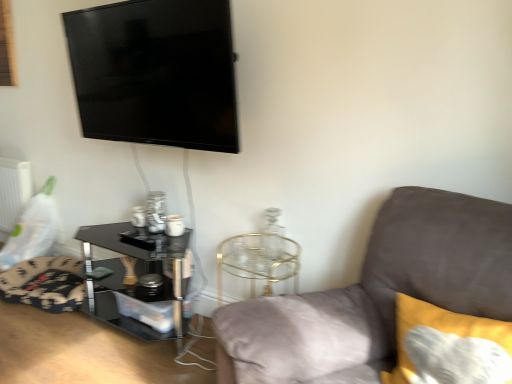
Describe the element at coordinates (155, 73) in the screenshot. Image resolution: width=512 pixels, height=384 pixels. I see `black glossy tv at upper left` at that location.

What do you see at coordinates (13, 191) in the screenshot? The image size is (512, 384). I see `white matte radiator at left` at bounding box center [13, 191].

In order to click on floral fabric swivel chair at lower left in this screenshot , I will do `click(45, 284)`.

The height and width of the screenshot is (384, 512). In order to click on black glass table at lower left in this screenshot , I will do `click(137, 275)`.

The image size is (512, 384). Describe the element at coordinates (376, 294) in the screenshot. I see `suede gray couch at right` at that location.

Image resolution: width=512 pixels, height=384 pixels. In order to click on black glossy tv at upper left in this screenshot , I will do `click(155, 73)`.

Is white matte radiator at left surrounding floral fabric swivel chair at lower left?

Actually, floral fabric swivel chair at lower left is outside white matte radiator at left.

From the image's perspective, is white matte radiator at left positioned above or below floral fabric swivel chair at lower left?

Clearly, from the image's perspective, white matte radiator at left is above floral fabric swivel chair at lower left.

From a real-world perspective, relative to floral fabric swivel chair at lower left, is white matte radiator at left vertically above or below?

In terms of real-world spatial position, white matte radiator at left is above floral fabric swivel chair at lower left.

Are white matte radiator at left and floral fabric swivel chair at lower left far apart?

No, white matte radiator at left is in close proximity to floral fabric swivel chair at lower left.

Based on the photo, does black glossy tv at upper left appear on the right side of suede gray couch at right?

No, black glossy tv at upper left is not to the right of suede gray couch at right.

From the picture: Can you confirm if black glossy tv at upper left is taller than suede gray couch at right?

Incorrect, the height of black glossy tv at upper left is not larger of that of suede gray couch at right.

From the image's perspective, between black glossy tv at upper left and suede gray couch at right, which one is located above?

black glossy tv at upper left is shown above in the image.

Can you confirm if black glossy tv at upper left is smaller than suede gray couch at right?

Correct, black glossy tv at upper left occupies less space than suede gray couch at right.

Which object is positioned more to the left, suede gray couch at right or black glass table at lower left?

Positioned to the left is black glass table at lower left.

Does point (317, 374) lie behind point (92, 299)?

That is False.

Is the depth of suede gray couch at right less than that of black glass table at lower left?

Yes, it is.

From the image's perspective, is suede gray couch at right above or below black glass table at lower left?

Clearly, from the image's perspective, suede gray couch at right is below black glass table at lower left.

Does suede gray couch at right have a larger size compared to soft yellow cushion at right?

Indeed, suede gray couch at right has a larger size compared to soft yellow cushion at right.

Which object is wider, suede gray couch at right or soft yellow cushion at right?

suede gray couch at right.

From a real-world perspective, relative to soft yellow cushion at right, is suede gray couch at right vertically above or below?

Clearly, from a real-world perspective, suede gray couch at right is below soft yellow cushion at right.

How many degrees apart are the facing directions of suede gray couch at right and soft yellow cushion at right?

1.17 degrees separate the facing orientations of suede gray couch at right and soft yellow cushion at right.

In the scene shown: From the image's perspective, relative to white matte radiator at left, is black glossy tv at upper left above or below?

black glossy tv at upper left is above white matte radiator at left.

Looking at their sizes, would you say black glossy tv at upper left is wider or thinner than white matte radiator at left?

Clearly, black glossy tv at upper left has more width compared to white matte radiator at left.

Which of these two, black glossy tv at upper left or white matte radiator at left, stands shorter?

white matte radiator at left is shorter.

From the picture: From a real-world perspective, relative to white matte radiator at left, is black glossy tv at upper left vertically above or below?

From a real-world perspective, black glossy tv at upper left is physically above white matte radiator at left.

Based on the photo, from the image's perspective, does black glass table at lower left appear higher than black glossy tv at upper left?

No, from the image's perspective, black glass table at lower left is not over black glossy tv at upper left.

Between black glass table at lower left and black glossy tv at upper left, which one appears on the left side from the viewer's perspective?

From the viewer's perspective, black glass table at lower left appears more on the left side.

Find the location of a particular element. table that is behind the black glossy tv at upper left is located at coordinates (137, 275).

How different are the orientations of black glossy tv at upper left and floral fabric swivel chair at lower left in degrees?

The facing directions of black glossy tv at upper left and floral fabric swivel chair at lower left are 0.559 degrees apart.

Is black glossy tv at upper left turned away from floral fabric swivel chair at lower left?

No, black glossy tv at upper left is not facing the opposite direction of floral fabric swivel chair at lower left.

Considering the sizes of objects black glossy tv at upper left and floral fabric swivel chair at lower left in the image provided, who is bigger, black glossy tv at upper left or floral fabric swivel chair at lower left?

black glossy tv at upper left is bigger.

Considering the positions of objects black glossy tv at upper left and floral fabric swivel chair at lower left in the image provided, who is more to the right, black glossy tv at upper left or floral fabric swivel chair at lower left?

From the viewer's perspective, black glossy tv at upper left appears more on the right side.

The width and height of the screenshot is (512, 384). I want to click on swivel chair lying in front of the white matte radiator at left, so click(45, 284).

Find the location of `studio couch below the black glossy tv at upper left (from a real-world perspective)`. studio couch below the black glossy tv at upper left (from a real-world perspective) is located at coordinates (376, 294).

Considering their positions, is black glass table at lower left positioned closer to floral fabric swivel chair at lower left than white matte radiator at left?

Among the two, black glass table at lower left is located nearer to floral fabric swivel chair at lower left.

Looking at this image, when comparing their distances from black glass table at lower left, does floral fabric swivel chair at lower left or soft yellow cushion at right seem closer?

floral fabric swivel chair at lower left is closer to black glass table at lower left.

Looking at the image, which one is located closer to soft yellow cushion at right, black glossy tv at upper left or white matte radiator at left?

Based on the image, black glossy tv at upper left appears to be nearer to soft yellow cushion at right.

From the image, which object appears to be farther from black glass table at lower left, soft yellow cushion at right or floral fabric swivel chair at lower left?

soft yellow cushion at right.

Estimate the real-world distances between objects in this image. Which object is closer to black glossy tv at upper left, floral fabric swivel chair at lower left or black glass table at lower left?

black glass table at lower left is positioned closer to the anchor black glossy tv at upper left.

Looking at the image, which one is located further to suede gray couch at right, black glossy tv at upper left or white matte radiator at left?

The object further to suede gray couch at right is white matte radiator at left.

From the image, which object appears to be farther from floral fabric swivel chair at lower left, suede gray couch at right or soft yellow cushion at right?

soft yellow cushion at right is positioned further to the anchor floral fabric swivel chair at lower left.

Looking at the image, which one is located closer to white matte radiator at left, soft yellow cushion at right or black glossy tv at upper left?

black glossy tv at upper left is closer to white matte radiator at left.

What are the coordinates of `table between suede gray couch at right and floral fabric swivel chair at lower left along the z-axis` in the screenshot? It's located at (137, 275).

This screenshot has height=384, width=512. What are the coordinates of `television between floral fabric swivel chair at lower left and soft yellow cushion at right in the horizontal direction` in the screenshot? It's located at (155, 73).

I want to click on table located between white matte radiator at left and black glossy tv at upper left in the left-right direction, so click(137, 275).

Locate an element on the screen. The image size is (512, 384). swivel chair situated between white matte radiator at left and soft yellow cushion at right from left to right is located at coordinates (45, 284).